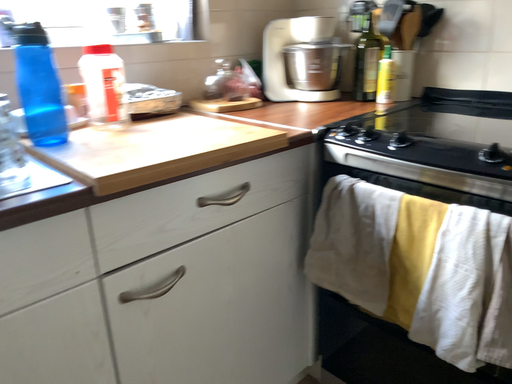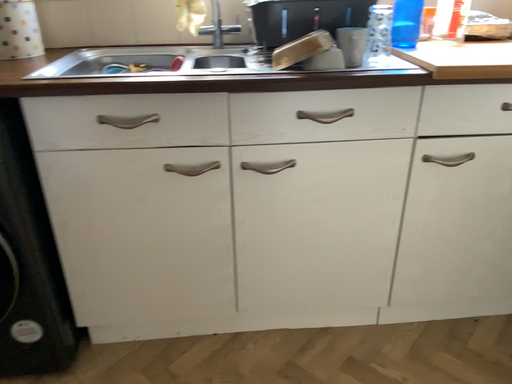
Question: How did the camera likely rotate when shooting the video?

Choices:
 (A) rotated right
 (B) rotated left

Answer: (B)